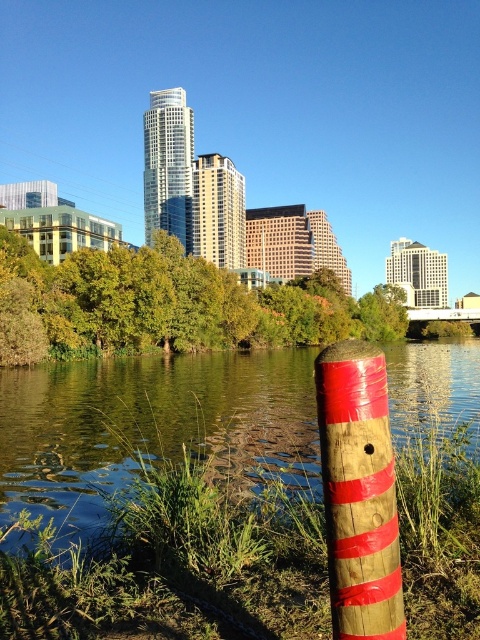
Who is shorter, green grass at lower left or wooden post with red stripes at center?

green grass at lower left is shorter.

In order to click on green grass at lower left in this screenshot , I will do `click(151, 426)`.

The height and width of the screenshot is (640, 480). What do you see at coordinates (151, 426) in the screenshot?
I see `green grass at lower left` at bounding box center [151, 426].

You are a GUI agent. You are given a task and a screenshot of the screen. Output one action in this format:
    pyautogui.click(x=<x>, y=<y>)
    Task: Click on the green grass at lower left
    The width and height of the screenshot is (480, 640).
    Given the screenshot: What is the action you would take?
    coord(151,426)